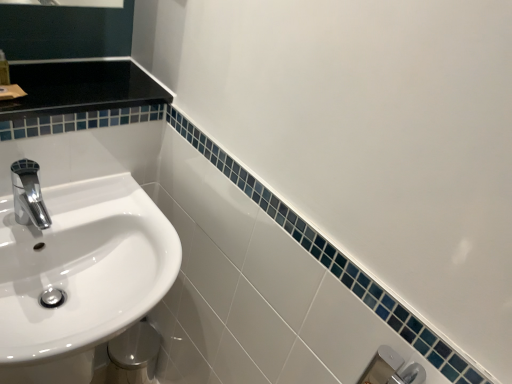
You are a GUI agent. You are given a task and a screenshot of the screen. Output one action in this format:
    pyautogui.click(x=<x>, y=<y>)
    Task: Click on the vacant space to the right of chrome/metallic faucet at left
    
    Given the screenshot: What is the action you would take?
    pyautogui.click(x=105, y=218)